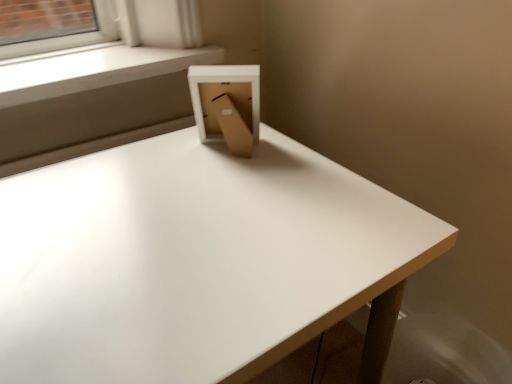
Find the location of a particular element. free space in front of cardboard box at center is located at coordinates (225, 195).